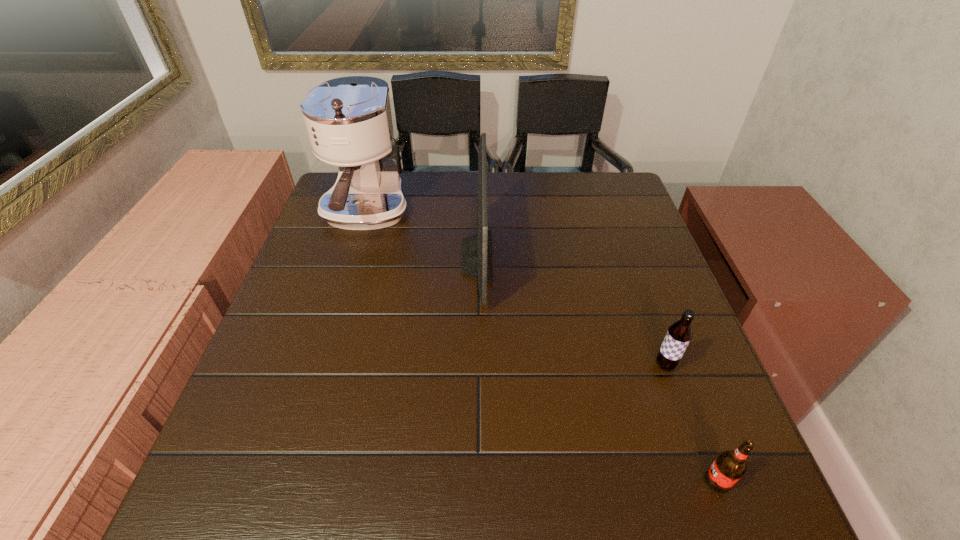
Where is `vacant space at the right edge of the desktop`? vacant space at the right edge of the desktop is located at coordinates (611, 297).

What are the coordinates of `vacant space at the far right corner of the desktop` in the screenshot? It's located at (606, 209).

The width and height of the screenshot is (960, 540). I want to click on vacant space at the near right corner of the desktop, so click(x=762, y=509).

Where is `free point between the leftmost object and the taller root beer`? This screenshot has height=540, width=960. free point between the leftmost object and the taller root beer is located at coordinates pyautogui.click(x=516, y=290).

The width and height of the screenshot is (960, 540). In order to click on vacant area that lies between the monitor and the nearer root beer in this screenshot , I will do `click(597, 369)`.

Locate an element on the screen. This screenshot has width=960, height=540. vacant space that's between the nearest object and the leftmost object is located at coordinates (541, 348).

Where is `blank region between the leftmost object and the second tallest object`? This screenshot has height=540, width=960. blank region between the leftmost object and the second tallest object is located at coordinates point(421,236).

Find the location of `unoccupied area between the leftmost object and the nearest object`. unoccupied area between the leftmost object and the nearest object is located at coordinates (541, 348).

Where is `empty space that is in between the shortest object and the leftmost object`? Image resolution: width=960 pixels, height=540 pixels. empty space that is in between the shortest object and the leftmost object is located at coordinates (541, 348).

What are the coordinates of `free space between the third farthest object and the leftmost object` in the screenshot? It's located at (516, 290).